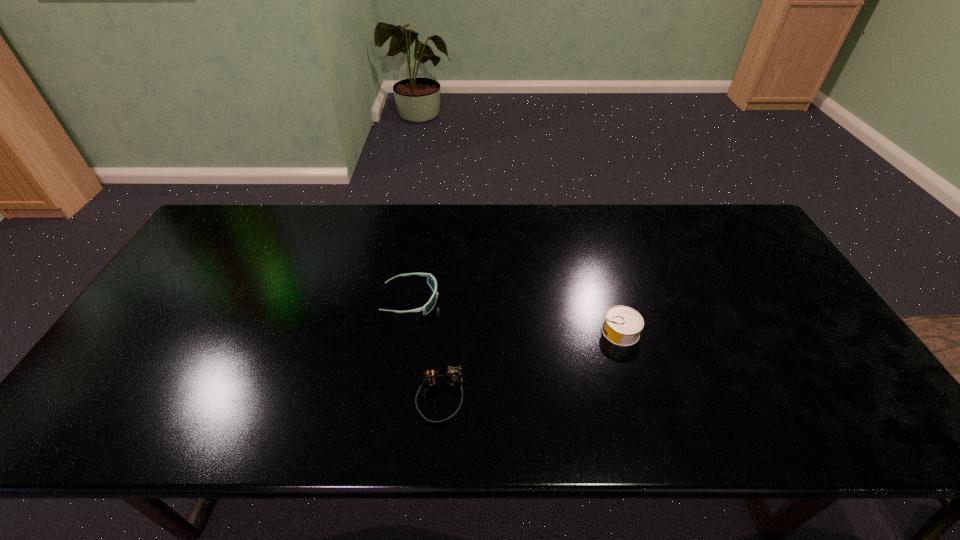
Identify the location of the farther goggles. Image resolution: width=960 pixels, height=540 pixels. (431, 281).

The width and height of the screenshot is (960, 540). I want to click on can, so click(x=622, y=326).

What are the coordinates of `the nearest object` in the screenshot? It's located at (453, 377).

Locate an element on the screen. The image size is (960, 540). vacant space located on the front-facing side of the farther goggles is located at coordinates (556, 300).

At what (x,y) coordinates should I click in order to perform the action: click on vacant space located on the right of the rightmost object. Please return your answer as a coordinate pair (x, y). This screenshot has width=960, height=540. Looking at the image, I should click on (764, 332).

You are a GUI agent. You are given a task and a screenshot of the screen. Output one action in this format:
    pyautogui.click(x=<x>, y=<y>)
    Task: Click on the object that is at the near edge
    
    Given the screenshot: What is the action you would take?
    pyautogui.click(x=453, y=377)

Where is `free spot at the far edge of the desktop`? The height and width of the screenshot is (540, 960). free spot at the far edge of the desktop is located at coordinates (559, 205).

The image size is (960, 540). In order to click on vacant space at the near edge in this screenshot , I will do `click(180, 416)`.

Find the location of a particular element. This screenshot has width=960, height=540. vacant area at the left edge is located at coordinates (129, 370).

Locate an element on the screen. vacant area at the right edge of the desktop is located at coordinates (870, 388).